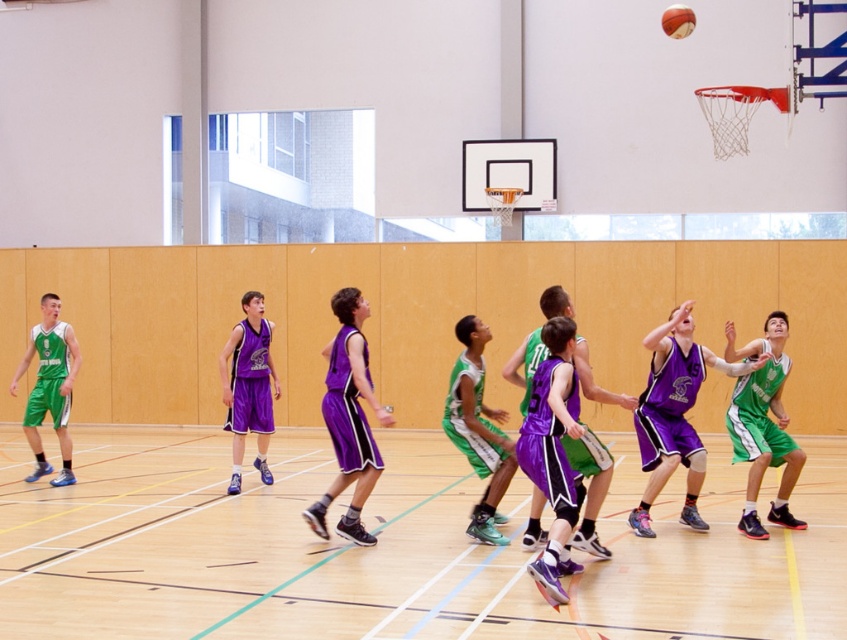
Question: Can you confirm if green jersey at center is thinner than purple shiny jersey at center?

Choices:
 (A) no
 (B) yes

Answer: (A)

Question: Which point is closer to the camera?

Choices:
 (A) purple matte basketball uniform at center
 (B) green matte basketball uniform at left
 (C) green matte basketball player at center
 (D) purple matte basketball player at center

Answer: (D)

Question: Which point is farther from the camera taking this photo?

Choices:
 (A) (451, 436)
 (B) (831, 518)
 (C) (259, 452)
 (D) (688, 456)

Answer: (C)

Question: Is purple jersey at center closer to camera compared to purple matte basketball player at center?

Choices:
 (A) yes
 (B) no

Answer: (B)

Question: Which of the following is the farthest from the observer?

Choices:
 (A) green matte basketball player at center
 (B) rubber textured basketball at upper right
 (C) green matte basketball uniform at left

Answer: (B)

Question: Can you confirm if green jersey at center is thinner than rubber textured basketball at upper right?

Choices:
 (A) no
 (B) yes

Answer: (A)